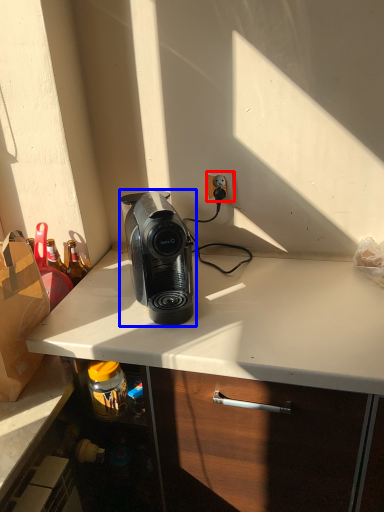
Question: Which point is further to the camera, power outlet (highlighted by a red box) or home appliance (highlighted by a blue box)?

Choices:
 (A) power outlet
 (B) home appliance

Answer: (A)